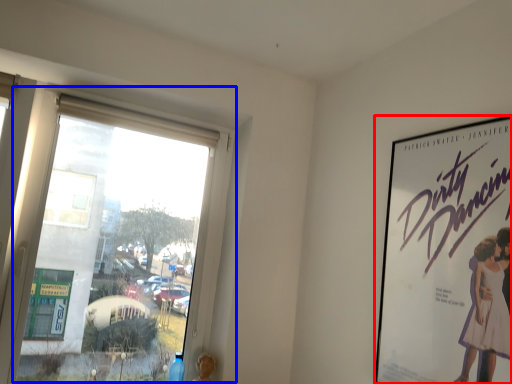
Question: Which object appears closest to the camera in this image, poster (highlighted by a red box) or window (highlighted by a blue box)?

Choices:
 (A) poster
 (B) window

Answer: (A)